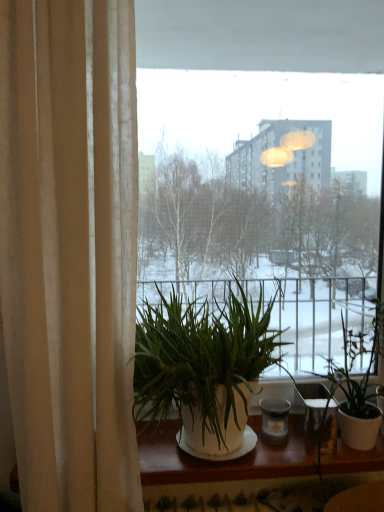
Question: From a real-world perspective, is green leafy plant at center, the 2th houseplant positioned from the right, physically below transparent glass window at center?

Choices:
 (A) no
 (B) yes

Answer: (B)

Question: Is green leafy plant at center, marked as the first houseplant in a left-to-right arrangement, to the left of transparent glass window at center from the viewer's perspective?

Choices:
 (A) yes
 (B) no

Answer: (A)

Question: Is green leafy plant at center, marked as the first houseplant in a left-to-right arrangement, to the right of transparent glass window at center from the viewer's perspective?

Choices:
 (A) yes
 (B) no

Answer: (B)

Question: Is green leafy plant at center, marked as the first houseplant in a left-to-right arrangement, thinner than transparent glass window at center?

Choices:
 (A) no
 (B) yes

Answer: (A)

Question: Considering the relative sizes of green leafy plant at center, the 2th houseplant positioned from the right, and transparent glass window at center in the image provided, is green leafy plant at center, the 2th houseplant positioned from the right, shorter than transparent glass window at center?

Choices:
 (A) yes
 (B) no

Answer: (A)

Question: Is green leafy plant at center, marked as the first houseplant in a left-to-right arrangement, in front of transparent glass window at center?

Choices:
 (A) yes
 (B) no

Answer: (A)

Question: Considering the relative sizes of transparent glass window at center and green leafy plant at right, which ranks as the first houseplant in right-to-left order, in the image provided, is transparent glass window at center bigger than green leafy plant at right, which ranks as the first houseplant in right-to-left order,?

Choices:
 (A) yes
 (B) no

Answer: (A)

Question: Does transparent glass window at center have a smaller size compared to green leafy plant at right, which ranks as the first houseplant in right-to-left order?

Choices:
 (A) yes
 (B) no

Answer: (B)

Question: From the image's perspective, is transparent glass window at center located above green leafy plant at right, which ranks as the first houseplant in right-to-left order?

Choices:
 (A) yes
 (B) no

Answer: (A)

Question: Is transparent glass window at center at the left side of green leafy plant at right, which ranks as the first houseplant in right-to-left order?

Choices:
 (A) yes
 (B) no

Answer: (A)

Question: Is transparent glass window at center thinner than green leafy plant at right, the second houseplant from the left?

Choices:
 (A) no
 (B) yes

Answer: (B)

Question: From a real-world perspective, does transparent glass window at center sit lower than green leafy plant at right, the second houseplant from the left?

Choices:
 (A) yes
 (B) no

Answer: (B)

Question: Is green leafy plant at right, the second houseplant from the left, a part of beige fabric curtain at left?

Choices:
 (A) no
 (B) yes

Answer: (A)